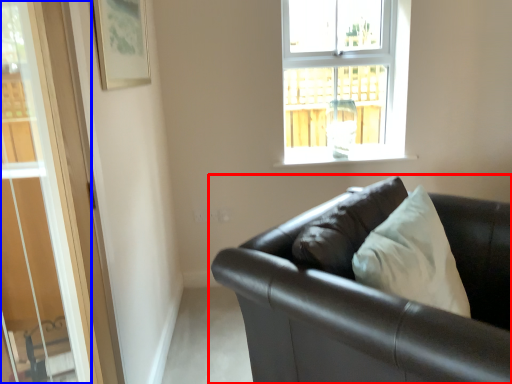
Question: Which object appears closest to the camera in this image, studio couch (highlighted by a red box) or glass door (highlighted by a blue box)?

Choices:
 (A) studio couch
 (B) glass door

Answer: (B)